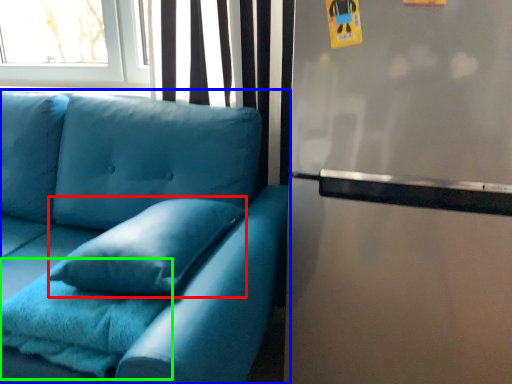
Question: Estimate the real-world distances between objects in this image. Which object is farther from pillow (highlighted by a red box), studio couch (highlighted by a blue box) or blanket (highlighted by a green box)?

Choices:
 (A) studio couch
 (B) blanket

Answer: (A)